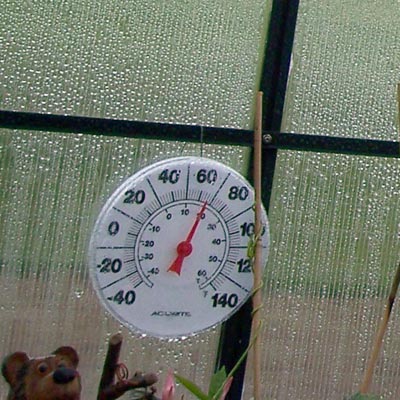
Locate an element on the screen. window panes is located at coordinates (282, 28), (141, 129), (353, 143).